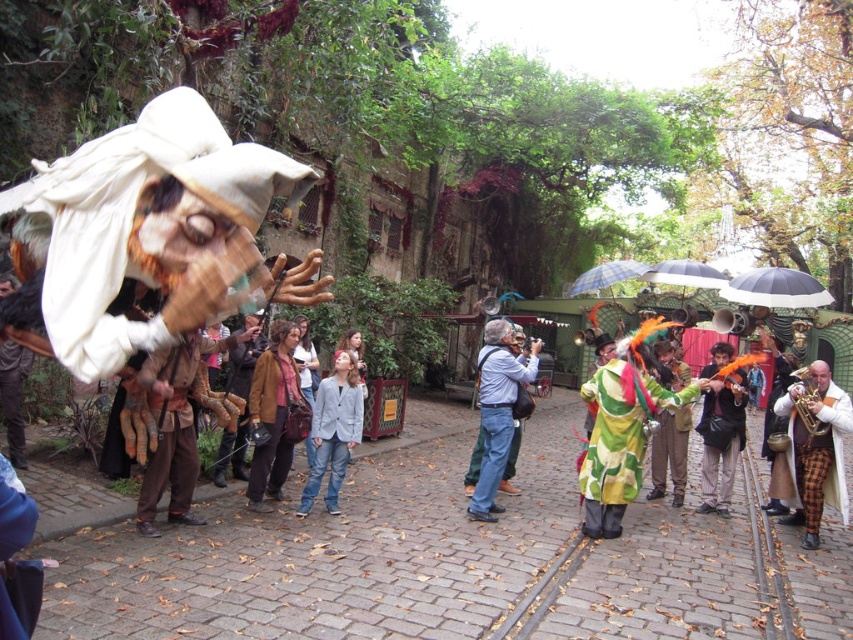
Question: Which is nearer to the plaid wool pants at right?

Choices:
 (A) multicolored feathered costume at center
 (B) checkered fabric umbrella at center

Answer: (A)

Question: Which point is closer to the camera?

Choices:
 (A) brown leather jacket at center
 (B) checkered fabric umbrella at center

Answer: (A)

Question: Among these objects, which one is farthest from the camera?

Choices:
 (A) green fabric costume at center
 (B) multicolored feathered costume at center
 (C) checkered fabric umbrella at center

Answer: (C)

Question: Where is light gray cotton jacket at center located in relation to brown leather jacket at center in the image?

Choices:
 (A) above
 (B) below

Answer: (A)

Question: In this image, where is plaid wool pants at right located relative to multicolored feathered costume at center?

Choices:
 (A) left
 (B) right

Answer: (B)

Question: Does light gray cotton jacket at center appear under checkered fabric umbrella at center?

Choices:
 (A) no
 (B) yes

Answer: (B)